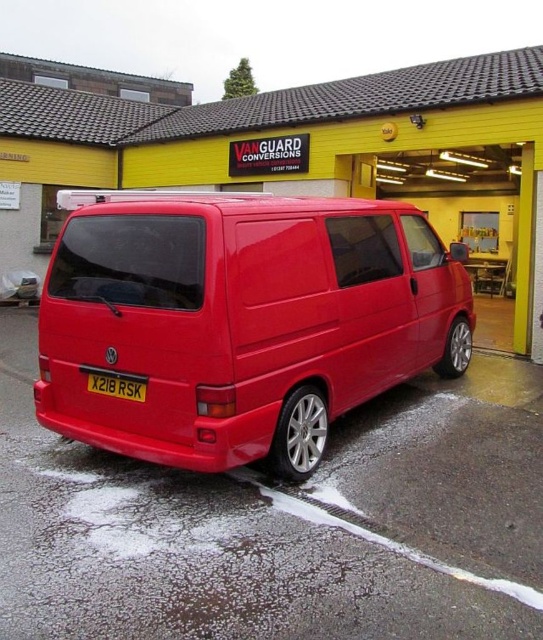
Who is more forward, (405, 225) or (134, 388)?

Point (134, 388) is in front.

Is glossy red van at center behind yellow matte license plate at rear?

No, it is in front of yellow matte license plate at rear.

Image resolution: width=543 pixels, height=640 pixels. I want to click on glossy red van at center, so click(241, 321).